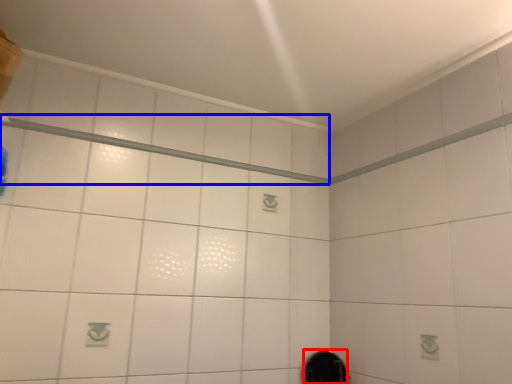
Question: Which of the following is the closest to the observer, mirror (highlighted by a red box) or shower (highlighted by a blue box)?

Choices:
 (A) mirror
 (B) shower

Answer: (B)